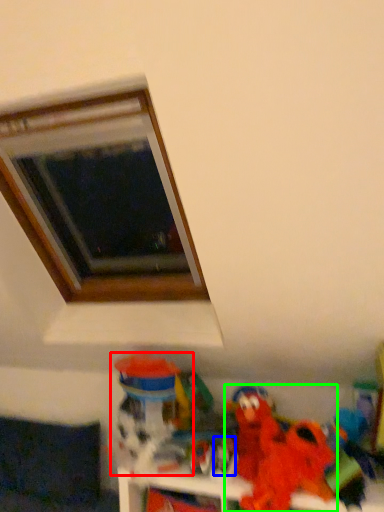
Question: Based on their relative distances, which object is farther from toy (highlighted by a red box)? Choose from toy (highlighted by a blue box) and toy (highlighted by a green box).

Choices:
 (A) toy
 (B) toy

Answer: (B)